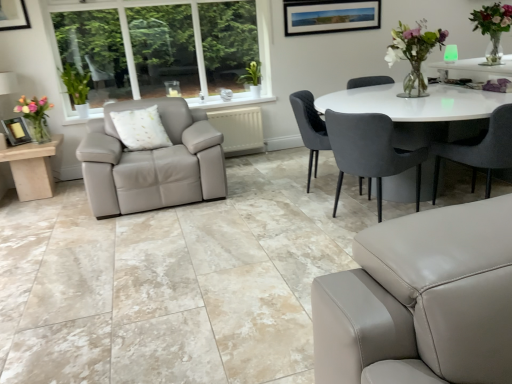
I want to click on vacant area that lies in front of matte black picture frame at lower left, so click(13, 147).